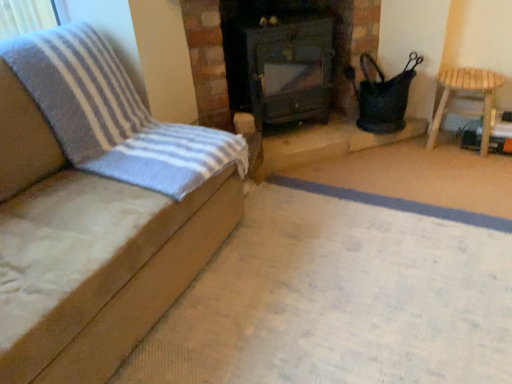
This screenshot has height=384, width=512. What are the coordinates of `light brown wooden stool at right, arranged as the 2th furniture when viewed from the front` in the screenshot? It's located at (467, 99).

I want to click on dark green wood stove at center, so click(280, 58).

I want to click on light brown wooden stool at right, which is the second furniture in left-to-right order, so click(467, 99).

Is suede-like beige sofa at left, which appears as the first furniture when viewed from the left, looking in the opposite direction of dark green wood stove at center?

That's not correct — suede-like beige sofa at left, which appears as the first furniture when viewed from the left, is not looking away from dark green wood stove at center.

Is suede-like beige sofa at left, which ranks as the 1th furniture in front-to-back order, not near dark green wood stove at center?

Absolutely, suede-like beige sofa at left, which ranks as the 1th furniture in front-to-back order, is distant from dark green wood stove at center.

Would you say suede-like beige sofa at left, which ranks as the 1th furniture in front-to-back order, is outside dark green wood stove at center?

Yes, suede-like beige sofa at left, which ranks as the 1th furniture in front-to-back order, is located beyond the bounds of dark green wood stove at center.

Is the depth of suede-like beige sofa at left, which appears as the first furniture when viewed from the left, greater than that of dark green wood stove at center?

No, the depth of suede-like beige sofa at left, which appears as the first furniture when viewed from the left, is less than that of dark green wood stove at center.

You are a GUI agent. You are given a task and a screenshot of the screen. Output one action in this format:
    pyautogui.click(x=<x>, y=<y>)
    Task: Click on the furniture below the light brown wooden stool at right, arranged as the 2th furniture when viewed from the front (from the image's perspective)
    This screenshot has width=512, height=384.
    Given the screenshot: What is the action you would take?
    pyautogui.click(x=97, y=208)

Looking at their sizes, would you say light brown wooden stool at right, arranged as the 2th furniture when viewed from the front, is wider or thinner than suede-like beige sofa at left, which ranks as the 1th furniture in front-to-back order?

In the image, light brown wooden stool at right, arranged as the 2th furniture when viewed from the front, appears to be more narrow than suede-like beige sofa at left, which ranks as the 1th furniture in front-to-back order.

From the image's perspective, is light brown wooden stool at right, which ranks as the 1th furniture in back-to-front order, above suede-like beige sofa at left, the second furniture when ordered from right to left?

Yes, from the image's perspective, light brown wooden stool at right, which ranks as the 1th furniture in back-to-front order, is over suede-like beige sofa at left, the second furniture when ordered from right to left.

Is light brown wooden stool at right, which is the second furniture in left-to-right order, with suede-like beige sofa at left, which appears as the first furniture when viewed from the left?

There is a gap between light brown wooden stool at right, which is the second furniture in left-to-right order, and suede-like beige sofa at left, which appears as the first furniture when viewed from the left.

In terms of width, does suede-like beige sofa at left, the 2th furniture when ordered from back to front, look wider or thinner when compared to light brown wooden stool at right, arranged as the 2th furniture when viewed from the front?

suede-like beige sofa at left, the 2th furniture when ordered from back to front, is wider than light brown wooden stool at right, arranged as the 2th furniture when viewed from the front.

Is the depth of suede-like beige sofa at left, which appears as the first furniture when viewed from the left, greater than that of light brown wooden stool at right, which is the second furniture in left-to-right order?

No.

Is suede-like beige sofa at left, which appears as the first furniture when viewed from the left, taller than light brown wooden stool at right, which is the second furniture in left-to-right order?

Yes, suede-like beige sofa at left, which appears as the first furniture when viewed from the left, is taller than light brown wooden stool at right, which is the second furniture in left-to-right order.

Based on the photo, choose the correct answer: Is suede-like beige sofa at left, which ranks as the 1th furniture in front-to-back order, inside light brown wooden stool at right, arranged as the 2th furniture when viewed from the front, or outside it?

suede-like beige sofa at left, which ranks as the 1th furniture in front-to-back order, is spatially situated outside light brown wooden stool at right, arranged as the 2th furniture when viewed from the front.

Considering the positions of objects dark green wood stove at center and suede-like beige sofa at left, the 2th furniture when ordered from back to front, in the image provided, who is in front, dark green wood stove at center or suede-like beige sofa at left, the 2th furniture when ordered from back to front,?

Positioned in front is suede-like beige sofa at left, the 2th furniture when ordered from back to front.

How distant is dark green wood stove at center from suede-like beige sofa at left, the 2th furniture when ordered from back to front?

dark green wood stove at center and suede-like beige sofa at left, the 2th furniture when ordered from back to front, are 1.10 meters apart.

Based on their positions, is dark green wood stove at center located to the left or right of suede-like beige sofa at left, which appears as the first furniture when viewed from the left?

Based on their positions, dark green wood stove at center is located to the right of suede-like beige sofa at left, which appears as the first furniture when viewed from the left.

Which of these two, dark green wood stove at center or suede-like beige sofa at left, the 2th furniture when ordered from back to front, is bigger?

suede-like beige sofa at left, the 2th furniture when ordered from back to front.

Is light brown wooden stool at right, which ranks as the 1th furniture in back-to-front order, positioned in front of dark green wood stove at center?

No, light brown wooden stool at right, which ranks as the 1th furniture in back-to-front order, is further to the viewer.

Does light brown wooden stool at right, which is the second furniture in left-to-right order, appear on the left side of dark green wood stove at center?

No.

Identify the location of stove that is above the light brown wooden stool at right, which is the second furniture in left-to-right order (from a real-world perspective). (280, 58).

From the image's perspective, is light brown wooden stool at right, which ranks as the first furniture in right-to-left order, located above or below dark green wood stove at center?

Clearly, from the image's perspective, light brown wooden stool at right, which ranks as the first furniture in right-to-left order, is below dark green wood stove at center.

Would you say dark green wood stove at center is to the left or to the right of light brown wooden stool at right, arranged as the 2th furniture when viewed from the front, in the picture?

dark green wood stove at center is positioned on light brown wooden stool at right, arranged as the 2th furniture when viewed from the front,'s left side.

Considering the sizes of objects dark green wood stove at center and light brown wooden stool at right, which ranks as the 1th furniture in back-to-front order, in the image provided, who is shorter, dark green wood stove at center or light brown wooden stool at right, which ranks as the 1th furniture in back-to-front order,?

light brown wooden stool at right, which ranks as the 1th furniture in back-to-front order, is shorter.

Does dark green wood stove at center have a larger size compared to light brown wooden stool at right, which is the second furniture in left-to-right order?

Yes.

Where is `stove behind the suede-like beige sofa at left, which appears as the first furniture when viewed from the left`? The image size is (512, 384). stove behind the suede-like beige sofa at left, which appears as the first furniture when viewed from the left is located at coordinates [x=280, y=58].

You are a GUI agent. You are given a task and a screenshot of the screen. Output one action in this format:
    pyautogui.click(x=<x>, y=<y>)
    Task: Click on the furniture above the suede-like beige sofa at left, the 2th furniture when ordered from back to front (from the image's perspective)
    
    Given the screenshot: What is the action you would take?
    pyautogui.click(x=467, y=99)

Estimate the real-world distances between objects in this image. Which object is closer to light brown wooden stool at right, which is the second furniture in left-to-right order, dark green wood stove at center or suede-like beige sofa at left, the 2th furniture when ordered from back to front?

Based on the image, dark green wood stove at center appears to be nearer to light brown wooden stool at right, which is the second furniture in left-to-right order.

Based on their spatial positions, is light brown wooden stool at right, which ranks as the 1th furniture in back-to-front order, or suede-like beige sofa at left, the second furniture when ordered from right to left, further from dark green wood stove at center?

suede-like beige sofa at left, the second furniture when ordered from right to left, lies further to dark green wood stove at center than the other object.

Which object lies further to the anchor point dark green wood stove at center, suede-like beige sofa at left, which ranks as the 1th furniture in front-to-back order, or light brown wooden stool at right, which ranks as the 1th furniture in back-to-front order?

suede-like beige sofa at left, which ranks as the 1th furniture in front-to-back order.

Which object lies further to the anchor point light brown wooden stool at right, which ranks as the 1th furniture in back-to-front order, suede-like beige sofa at left, which appears as the first furniture when viewed from the left, or dark green wood stove at center?

The object further to light brown wooden stool at right, which ranks as the 1th furniture in back-to-front order, is suede-like beige sofa at left, which appears as the first furniture when viewed from the left.

In the scene shown: Which object lies nearer to the anchor point suede-like beige sofa at left, which ranks as the 1th furniture in front-to-back order, dark green wood stove at center or light brown wooden stool at right, which is the second furniture in left-to-right order?

dark green wood stove at center is positioned closer to the anchor suede-like beige sofa at left, which ranks as the 1th furniture in front-to-back order.

Considering their positions, is light brown wooden stool at right, arranged as the 2th furniture when viewed from the front, positioned further to suede-like beige sofa at left, which appears as the first furniture when viewed from the left, than dark green wood stove at center?

light brown wooden stool at right, arranged as the 2th furniture when viewed from the front.

I want to click on stove situated between suede-like beige sofa at left, which ranks as the 1th furniture in front-to-back order, and light brown wooden stool at right, which ranks as the 1th furniture in back-to-front order, from left to right, so click(280, 58).